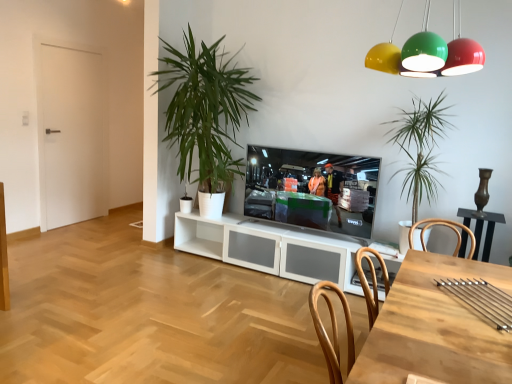
Question: Considering the relative sizes of white matte door at left and metallic dome lights at upper center in the image provided, is white matte door at left taller than metallic dome lights at upper center?

Choices:
 (A) no
 (B) yes

Answer: (B)

Question: Does white matte door at left have a lesser height compared to metallic dome lights at upper center?

Choices:
 (A) yes
 (B) no

Answer: (B)

Question: Is white matte door at left outside metallic dome lights at upper center?

Choices:
 (A) yes
 (B) no

Answer: (A)

Question: Is there a large distance between white matte door at left and metallic dome lights at upper center?

Choices:
 (A) yes
 (B) no

Answer: (A)

Question: Does white matte door at left lie in front of metallic dome lights at upper center?

Choices:
 (A) no
 (B) yes

Answer: (A)

Question: From a real-world perspective, is white matte door at left located beneath metallic dome lights at upper center?

Choices:
 (A) no
 (B) yes

Answer: (B)

Question: From the image's perspective, is wooden table at lower right located above matte black television at center?

Choices:
 (A) yes
 (B) no

Answer: (B)

Question: Is wooden table at lower right not near matte black television at center?

Choices:
 (A) yes
 (B) no

Answer: (A)

Question: Is the depth of wooden table at lower right less than that of matte black television at center?

Choices:
 (A) yes
 (B) no

Answer: (A)

Question: From a real-world perspective, is wooden table at lower right physically below matte black television at center?

Choices:
 (A) no
 (B) yes

Answer: (B)

Question: Can you confirm if wooden table at lower right is bigger than matte black television at center?

Choices:
 (A) yes
 (B) no

Answer: (A)

Question: Is wooden table at lower right positioned beyond the bounds of matte black television at center?

Choices:
 (A) no
 (B) yes

Answer: (B)

Question: Is green leafy plant at center, the first houseplant positioned from the left, thinner than wooden table at lower right?

Choices:
 (A) yes
 (B) no

Answer: (B)